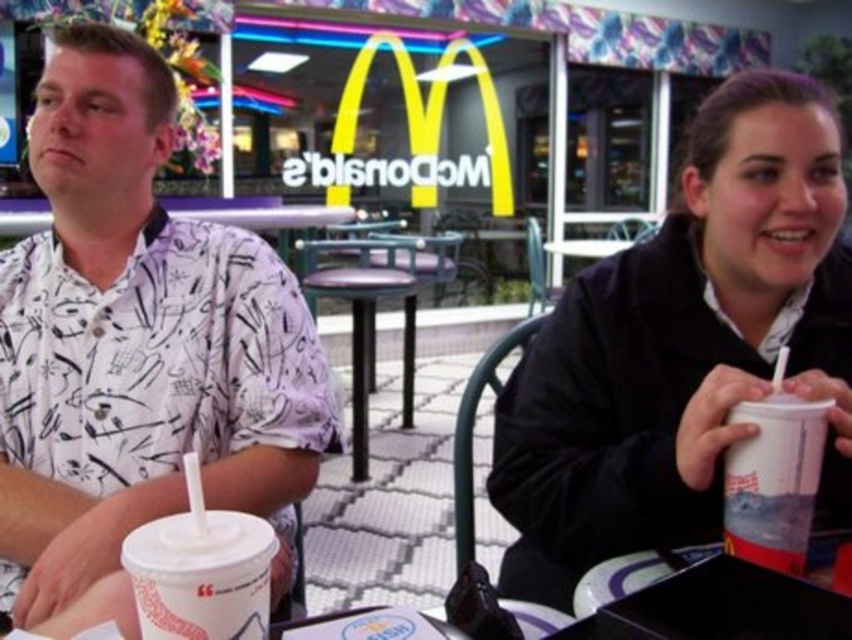
You are a delivery person who needs to place a package between the white printed shirt at left and the white paper cup at right. Which object should you position the package closer to if the package must be placed at a higher elevation?

The white printed shirt at left is taller than the white paper cup at right, so you should position the package closer to the white printed shirt at left to achieve a higher elevation.